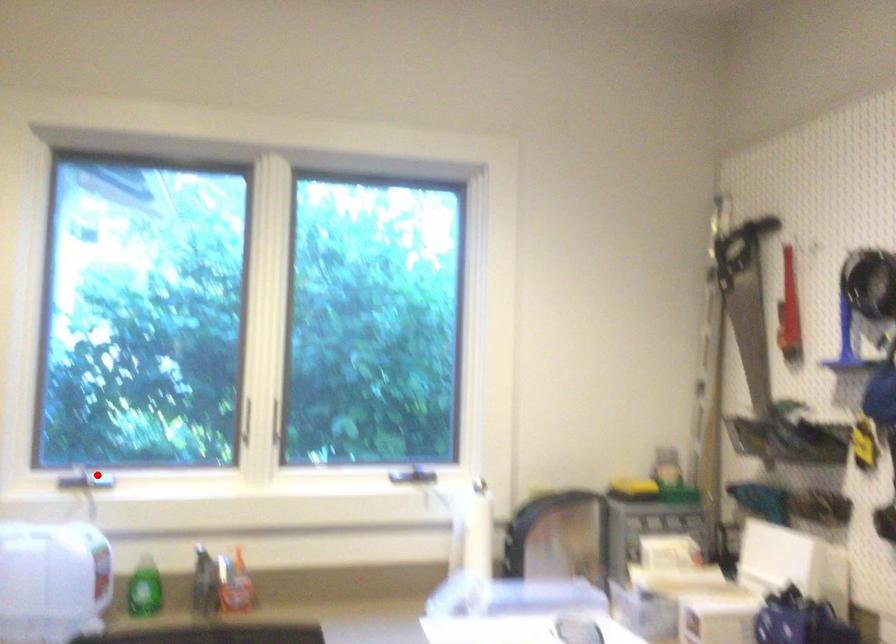
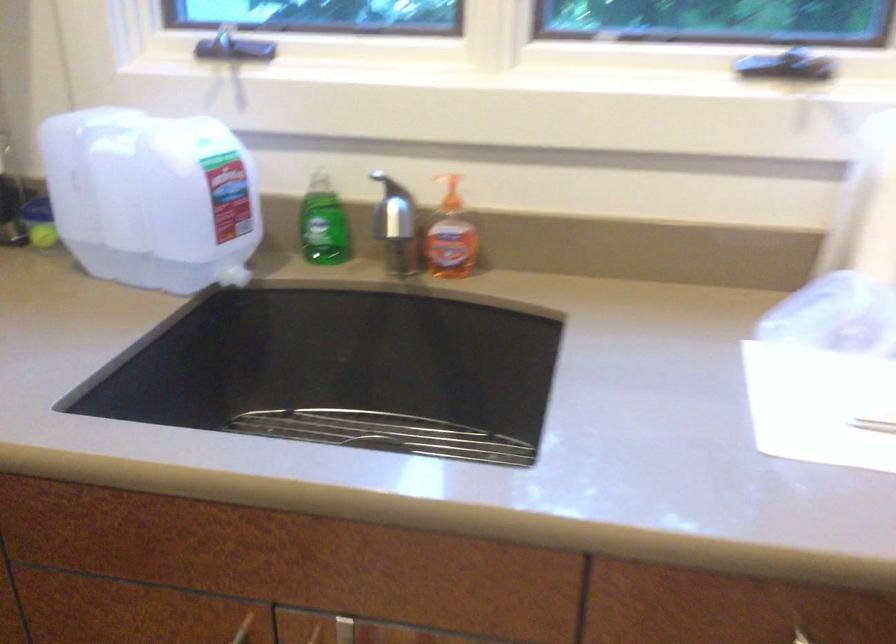
Find the pixel in the second image that matches the highlighted location in the first image.

(243, 48)